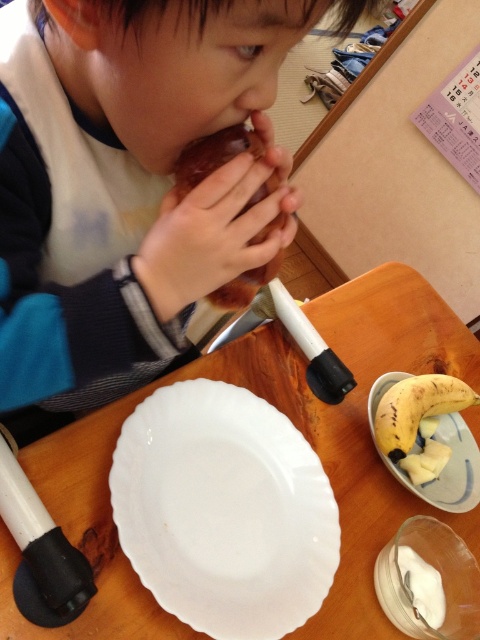
You are a chef preparing a meal and need to place both the wooden table at center and the yellow matte platter at lower right on your work surface. Given their sizes, which one should you place first to maximize space efficiency?

The wooden table at center is larger than the yellow matte platter at lower right, so you should place the wooden table at center first to maximize space efficiency.

Consider the image. You are standing at the position of the child in the image. There are two points marked in the scene. The first point is at coordinates point (x=8, y=99) and the second point is at coordinates point (x=309, y=602). Which point is closer to you?

The point at coordinates point (x=8, y=99) is closer to you because it is in front of the point at coordinates point (x=309, y=602).